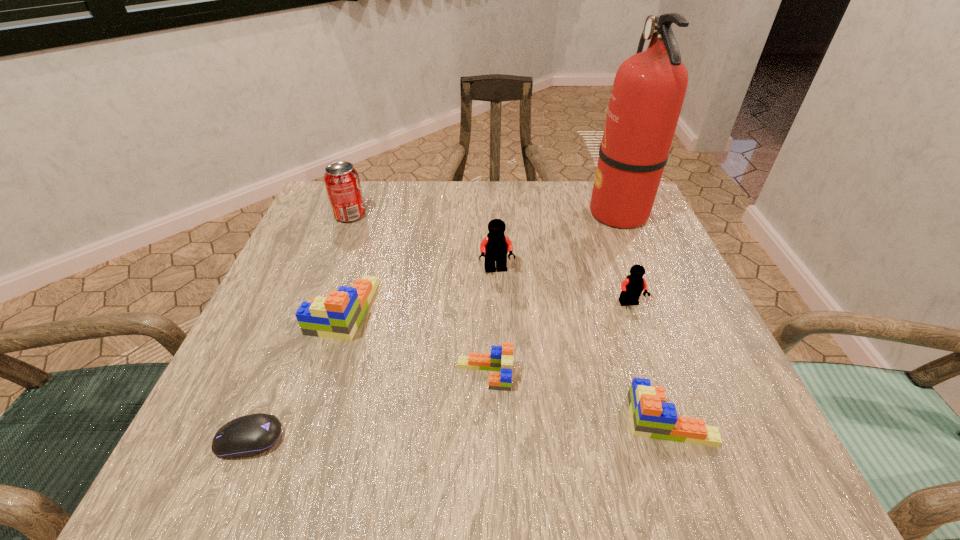
The height and width of the screenshot is (540, 960). What are the coordinates of `free space between the soda can and the fire extinguisher` in the screenshot? It's located at (484, 214).

The height and width of the screenshot is (540, 960). What are the coordinates of `free space between the computer mouse and the fourth farthest Lego` in the screenshot? It's located at (368, 407).

The width and height of the screenshot is (960, 540). I want to click on vacant space in between the second farthest orange Lego and the soda can, so click(x=418, y=295).

I want to click on object that stands as the fifth closest to the seventh tallest object, so click(x=246, y=436).

Where is `object that is the second nearest to the second orange Lego from right to left`? The width and height of the screenshot is (960, 540). object that is the second nearest to the second orange Lego from right to left is located at coordinates (337, 316).

You are a GUI agent. You are given a task and a screenshot of the screen. Output one action in this format:
    pyautogui.click(x=<x>, y=<y>)
    Task: Click on the closest Lego to the rightmost orange Lego
    
    Given the screenshot: What is the action you would take?
    pyautogui.click(x=501, y=358)

Find the location of a particular element. The height and width of the screenshot is (540, 960). Lego object that ranks as the fourth closest to the leftmost Lego is located at coordinates (632, 287).

Where is `the closest orange Lego relative to the smallest orange Lego`? Image resolution: width=960 pixels, height=540 pixels. the closest orange Lego relative to the smallest orange Lego is located at coordinates (651, 417).

Select which orange Lego appears as the second closest to the second farthest orange Lego. Please provide its 2D coordinates. Your answer should be formatted as a tuple, i.e. [(x, y)], where the tuple contains the x and y coordinates of a point satisfying the conditions above.

[(337, 316)]

Locate an element on the screen. free space in the image that satisfies the following two spatial constraints: 1. on the front side of the rightmost orange Lego; 2. on the right side of the leftmost orange Lego is located at coordinates (308, 420).